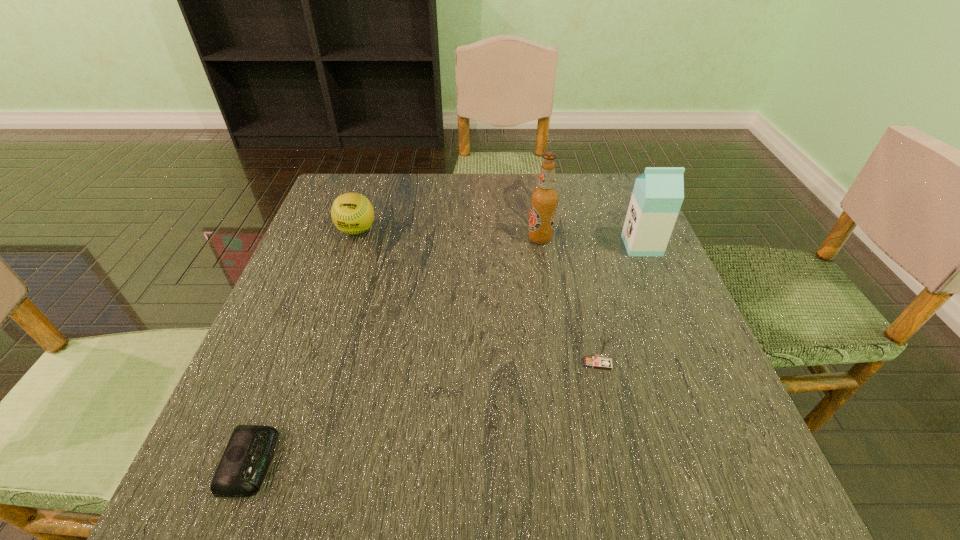
Locate an element on the screen. free space between the rightmost object and the fourth farthest object is located at coordinates (619, 304).

Identify the location of vacant space that's between the fourth object from left to right and the milk carton. (619, 304).

Locate an element on the screen. free space between the matchbox and the shortest object is located at coordinates (423, 413).

This screenshot has width=960, height=540. I want to click on vacant space in between the second nearest object and the shortest object, so click(x=423, y=413).

Identify the location of vacant space in between the shortest object and the fourth farthest object. The width and height of the screenshot is (960, 540). (423, 413).

The width and height of the screenshot is (960, 540). Find the location of `free point between the alarm clock and the softball`. free point between the alarm clock and the softball is located at coordinates (303, 346).

The height and width of the screenshot is (540, 960). What are the coordinates of `vacant region between the softball and the beer bottle` in the screenshot? It's located at [448, 234].

The width and height of the screenshot is (960, 540). What are the coordinates of `object that is the third nearest to the beer bottle` in the screenshot? It's located at (352, 213).

Locate an element on the screen. the closest object to the matchbox is located at coordinates (658, 193).

Identify the location of free space in the image that satisfies the following two spatial constraints: 1. on the logo side of the softball; 2. on the display of the alarm clock. (278, 462).